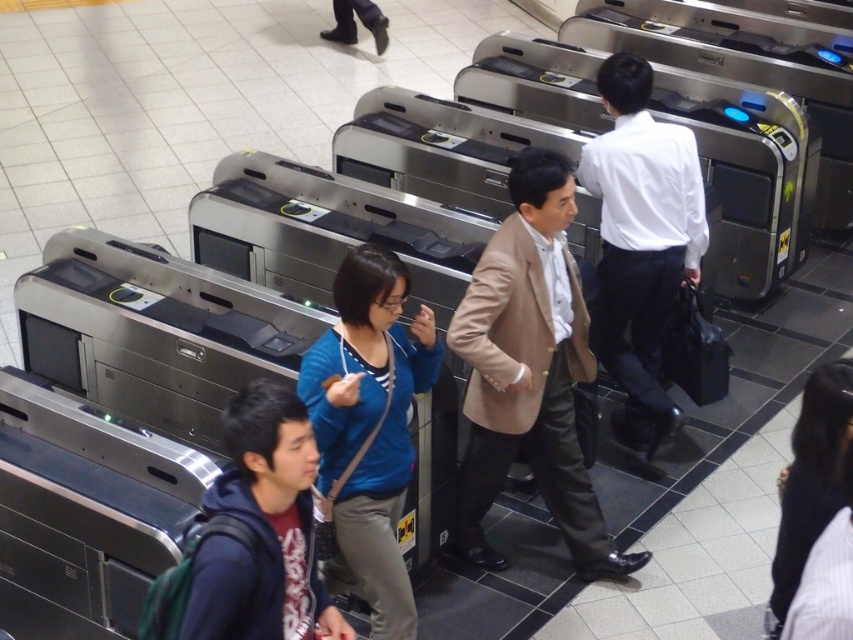
Question: Can you confirm if tan leather jacket at center is smaller than dark gray fabric jacket at center?

Choices:
 (A) yes
 (B) no

Answer: (B)

Question: Which object is positioned closest to the dark blue hoodie at center?

Choices:
 (A) tan leather jacket at center
 (B) black leather shoes at upper center
 (C) white glossy shirt at upper right

Answer: (A)

Question: Does tan leather jacket at center appear under dark gray fabric jacket at center?

Choices:
 (A) yes
 (B) no

Answer: (B)

Question: Which point appears farthest from the camera in this image?

Choices:
 (A) (376, 32)
 (B) (305, 444)

Answer: (A)

Question: Which object is positioned farthest from the tan leather jacket at center?

Choices:
 (A) white glossy shirt at upper right
 (B) dark blue hoodie at center
 (C) dark gray fabric jacket at center
 (D) black leather shoes at upper center

Answer: (D)

Question: Is tan leather jacket at center further to camera compared to white glossy shirt at upper right?

Choices:
 (A) no
 (B) yes

Answer: (A)